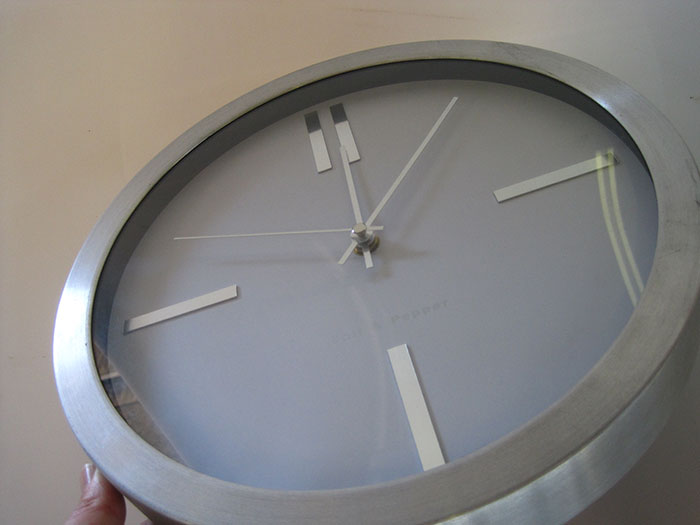
The width and height of the screenshot is (700, 525). Find the location of `gray text in middle of clock`. gray text in middle of clock is located at coordinates (354, 334), (411, 320).